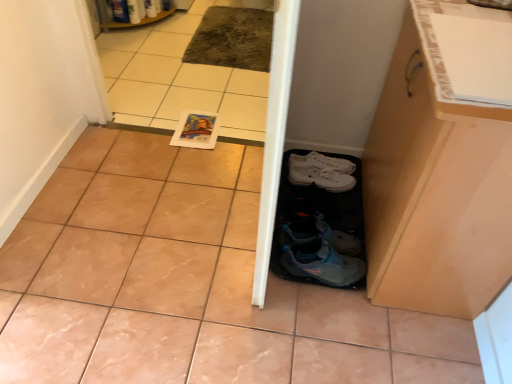
What are the coordinates of `white matte door at center` in the screenshot? It's located at (274, 136).

Describe the element at coordinates (274, 136) in the screenshot. This screenshot has height=384, width=512. I see `white matte door at center` at that location.

The height and width of the screenshot is (384, 512). In order to click on white matte door at center in this screenshot , I will do `click(274, 136)`.